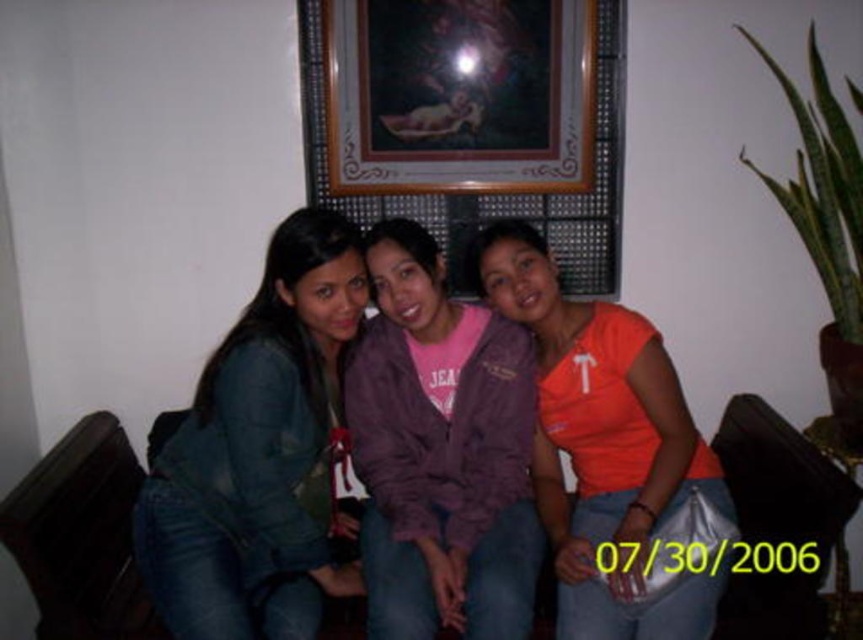
You are a photographer standing 6 feet away from the purple fleece jacket at center. Can you take a clear photo of it without moving closer?

The purple fleece jacket at center is 5.42 feet away from the viewer. Since you are standing 6 feet away, you are slightly farther than the jacket, so you might need to move closer to ensure clarity.

You are a photographer trying to adjust the lighting for a group photo. You need to place a spotlight at the same position as the denim jacket at center. What are the coordinates where you should place the spotlight?

The denim jacket at center is located at coordinates point (260, 452), so you should place the spotlight at those coordinates.

You are a photographer adjusting the lighting for a group photo. You notice the denim jacket at center and the orange matte shirt at center. Which clothing item is positioned higher on the person?

The denim jacket at center is located above the orange matte shirt at center, so the denim jacket at center is positioned higher.